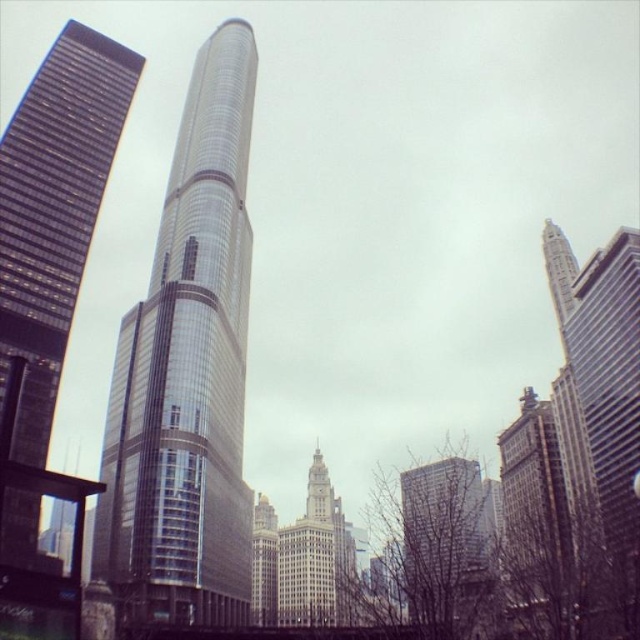
You are an architect analyzing the cityscape. You notice two central skyscrapers labeled as the shiny glass skyscraper at center and the metallic glass skyscraper at center. Which of these two has a larger footprint in the image?

The metallic glass skyscraper at center has a larger footprint than the shiny glass skyscraper at center, as it is described as being larger in size.

You are standing in front of the Trump International Hotel and Tower in Chicago. You notice two points marked on the building. The first point is at coordinates point (564, 528) and the second is at point (464, 515). Which of these points is closer to your viewpoint?

Point (564, 528) is closer to the camera than point (464, 515).

You are standing on a balcony overlooking the city and see the glassy reflective skyscraper at left and the brick building at center. Which building is closer to you?

The glassy reflective skyscraper at left is closer to you because it is positioned further to the viewer than the brick building at center.